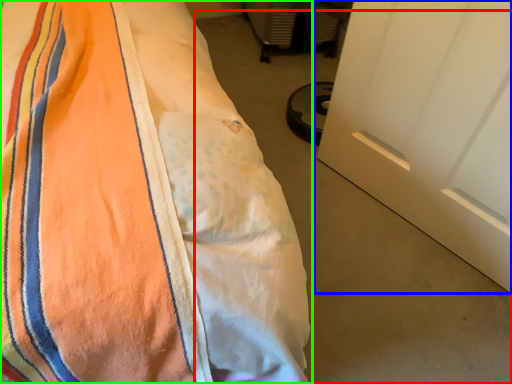
Question: Considering the real-world distances, which object is closest to concrete (highlighted by a red box)? door (highlighted by a blue box) or bed (highlighted by a green box).

Choices:
 (A) door
 (B) bed

Answer: (A)